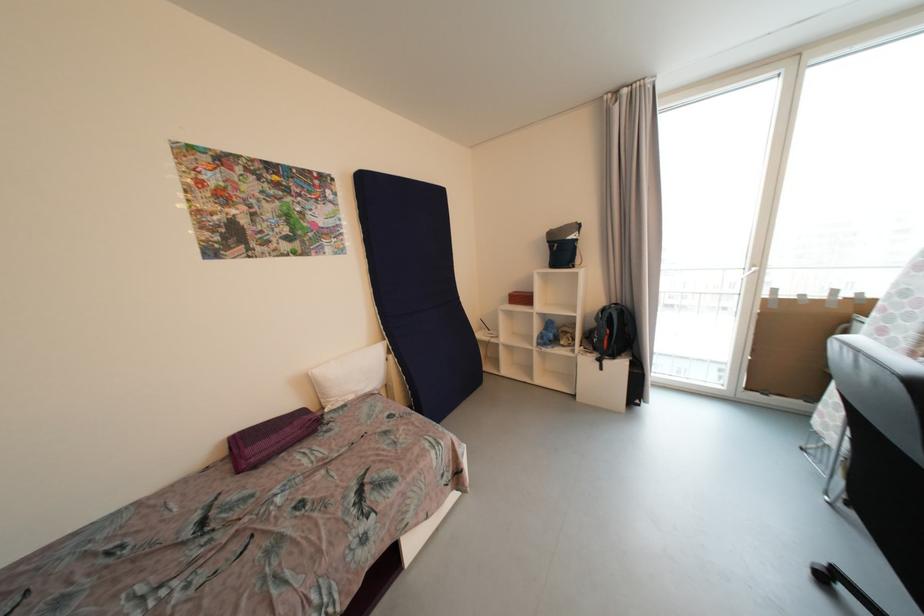
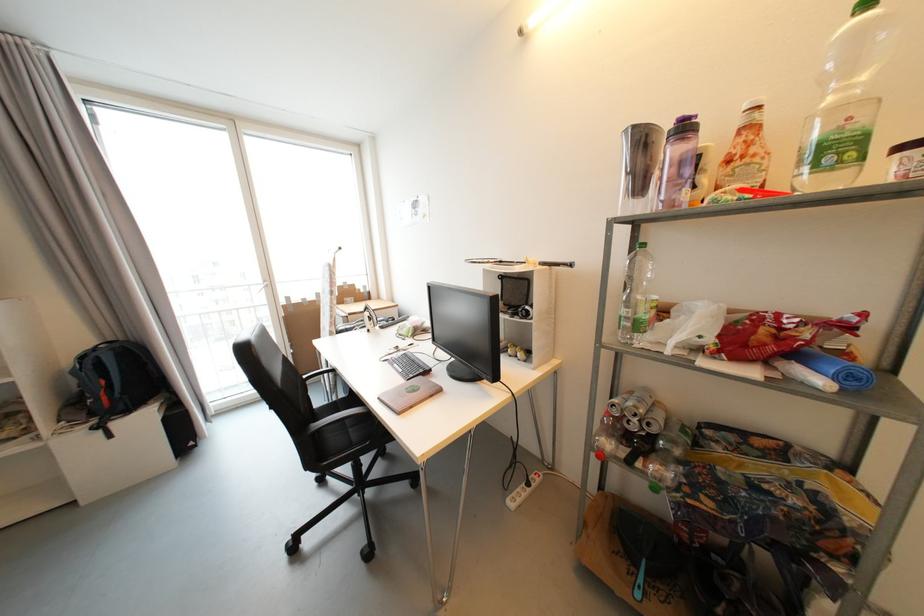
Question: The images are taken continuously from a first-person perspective. In which direction is your viewpoint rotating?

Choices:
 (A) Left
 (B) Right
 (C) Up
 (D) Down

Answer: (B)